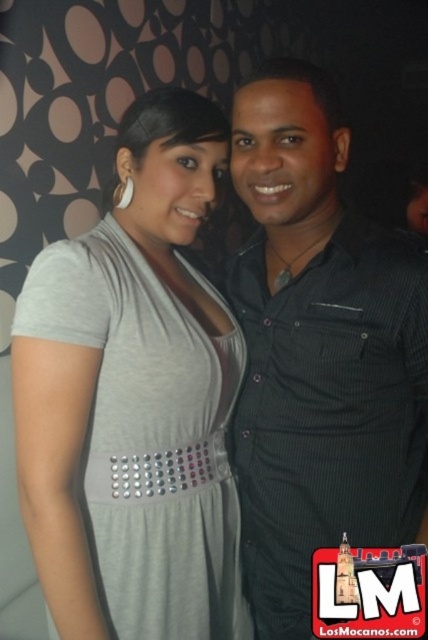
Question: From the image, what is the correct spatial relationship of black textured shirt at center in relation to gray matte dress at center?

Choices:
 (A) right
 (B) left

Answer: (A)

Question: Does black textured shirt at center have a larger size compared to gray matte dress at center?

Choices:
 (A) yes
 (B) no

Answer: (A)

Question: Which of the following is the closest to the observer?

Choices:
 (A) black textured shirt at center
 (B) gray matte dress at center

Answer: (B)

Question: Does black textured shirt at center come in front of gray matte dress at center?

Choices:
 (A) yes
 (B) no

Answer: (B)